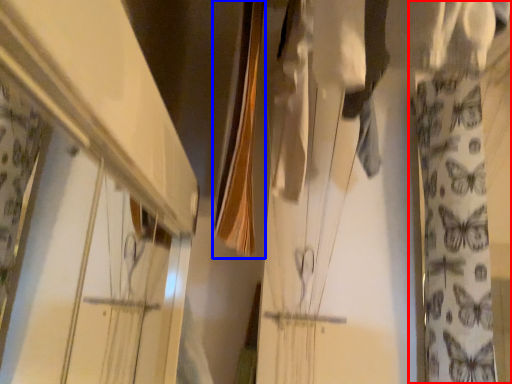
Question: Which object appears farthest to the camera in this image, curtain (highlighted by a red box) or clothesline (highlighted by a blue box)?

Choices:
 (A) curtain
 (B) clothesline

Answer: (A)